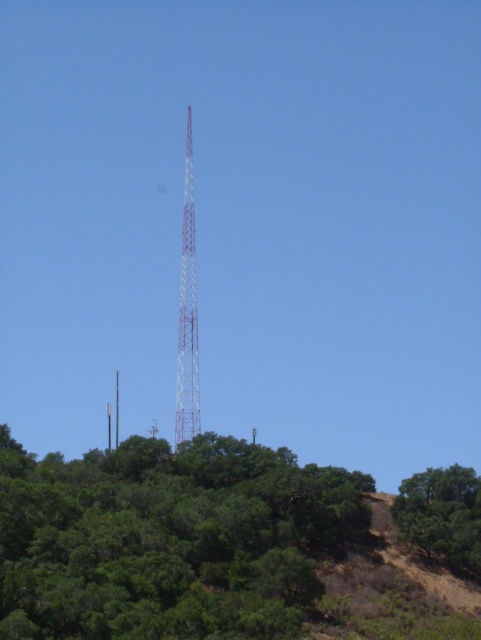
You are a bird looking for a place to perch. You can choose between the green leafy tree at lower right and the metallic tower at center. Which option is taller?

The metallic tower at center is taller than the green leafy tree at lower right, so the tower is the taller option.

You are standing on the hill looking at the scene. Which object is nearer to you, the green leafy tree at lower right or the metallic white tower at center?

The green leafy tree at lower right is closer to the viewer than the metallic white tower at center.

You are a hiker standing at the base of the hill where the red painted metal tower at center is located. You want to take a photo of the tower with the green leafy tree at center in the background. From your current position, which direction should you face to ensure the tree appears behind the tower in your photo?

The green leafy tree at center is positioned on the right side of the red painted metal tower at center. To have the tree appear behind the tower in your photo, you should face to the right of the tower so that the tree is aligned behind it.